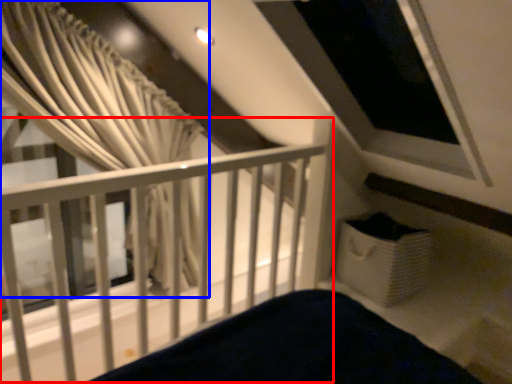
Question: Which of the following is the farthest to the observer, rail (highlighted by a red box) or curtain (highlighted by a blue box)?

Choices:
 (A) rail
 (B) curtain

Answer: (B)